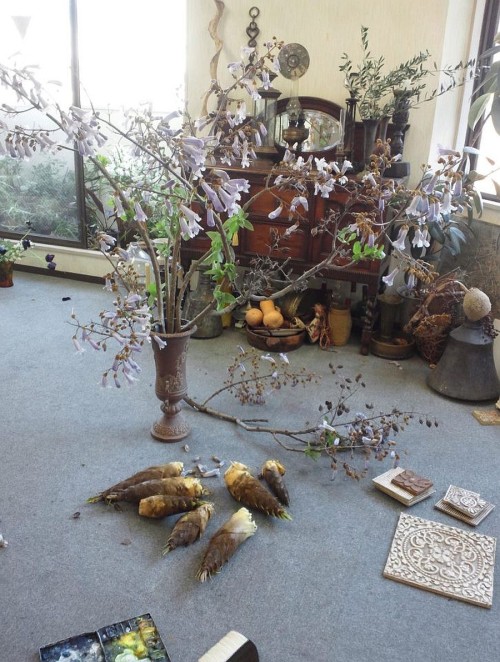
Find the location of `large brown urn vase filled with plants`. large brown urn vase filled with plants is located at coordinates click(164, 365).